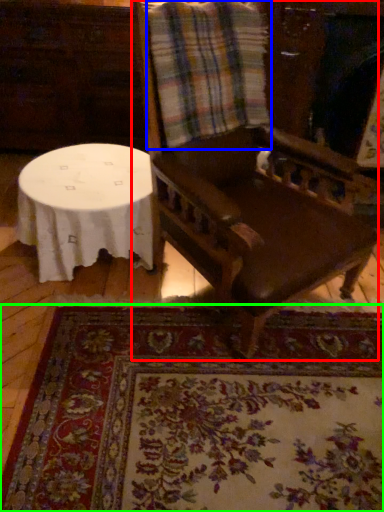
Question: Which object is the farthest from chair (highlighted by a red box)? Choose among these: flannel (highlighted by a blue box) or mat (highlighted by a green box).

Choices:
 (A) flannel
 (B) mat

Answer: (B)